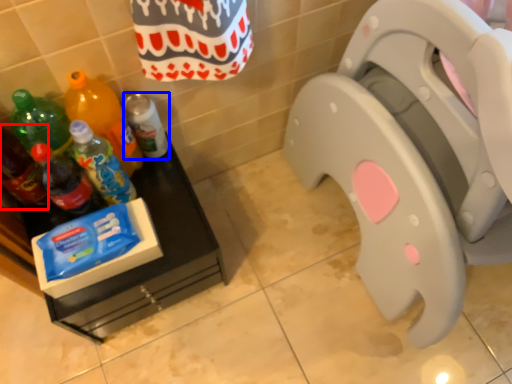
Question: Among these objects, which one is nearest to the camera, bottle (highlighted by a red box) or bottle (highlighted by a blue box)?

Choices:
 (A) bottle
 (B) bottle

Answer: (A)